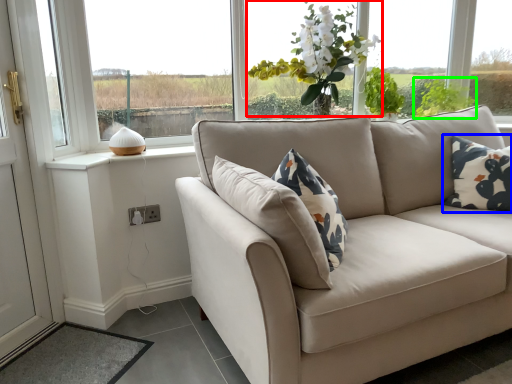
Question: Considering the real-world distances, which object is closest to floral arrangement (highlighted by a red box)? pillow (highlighted by a blue box) or plant (highlighted by a green box).

Choices:
 (A) pillow
 (B) plant

Answer: (B)